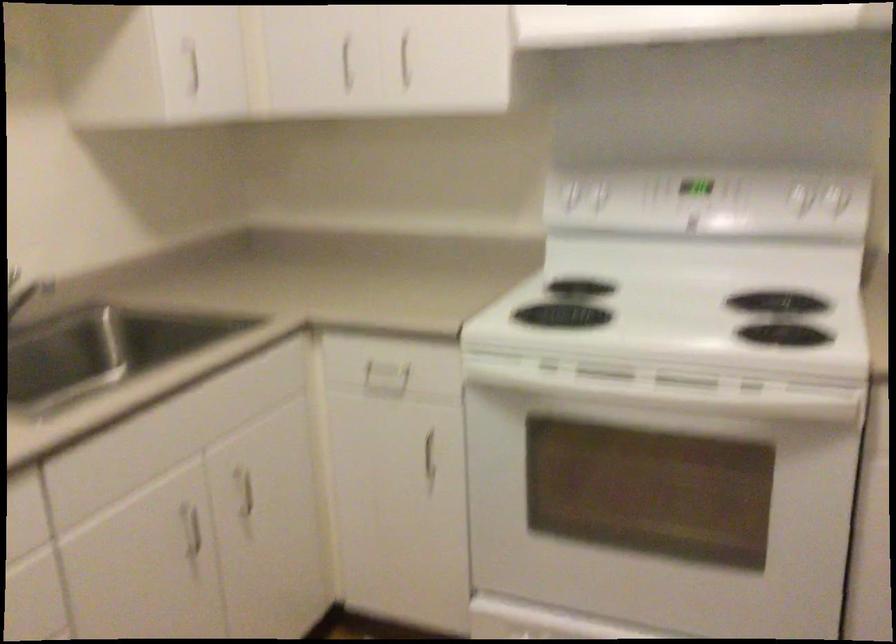
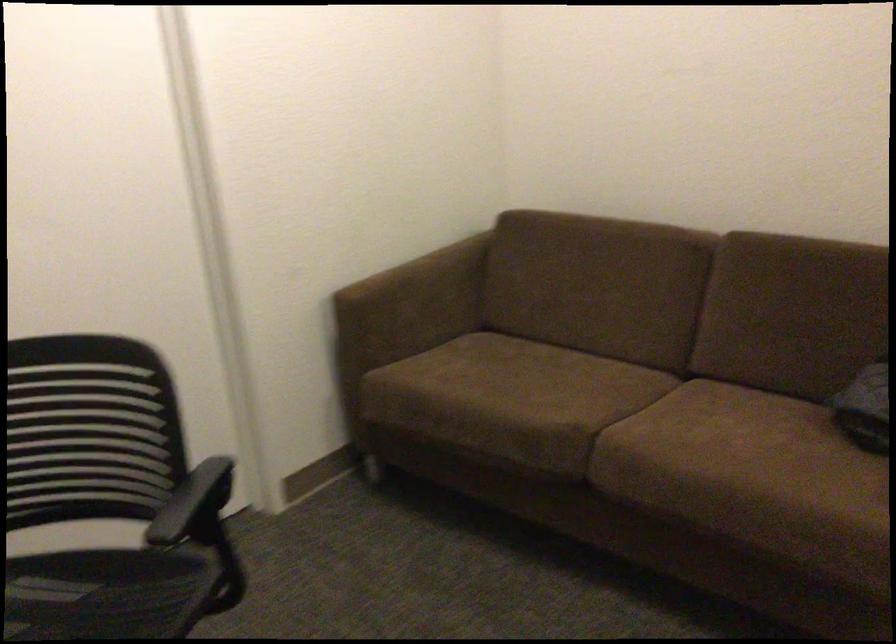
First-person continuous shooting, in which direction is the camera rotating?

The camera's rotation is toward left-down.